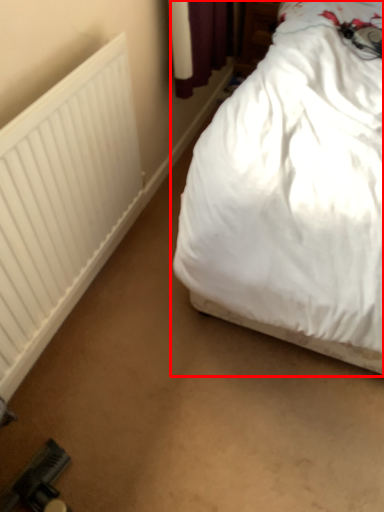
Question: From the image's perspective, where is bed (annotated by the red box) located relative to radiator?

Choices:
 (A) above
 (B) below

Answer: (A)